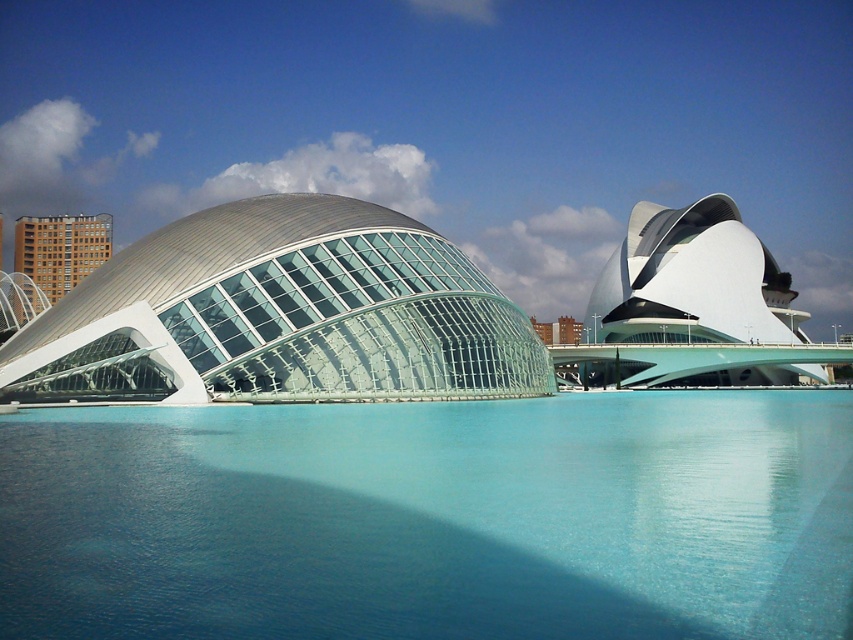
Who is shorter, transparent blue water at center or transparent glass dome at center?

With less height is transparent blue water at center.

Between transparent blue water at center and transparent glass dome at center, which one is positioned higher?

transparent glass dome at center is above.

The width and height of the screenshot is (853, 640). What are the coordinates of `transparent blue water at center` in the screenshot? It's located at (432, 518).

At what (x,y) coordinates should I click in order to perform the action: click on transparent blue water at center. Please return your answer as a coordinate pair (x, y). Looking at the image, I should click on (432, 518).

Between transparent glass dome at center and brown brick building at left, which one is positioned higher?

brown brick building at left

Is point (329, 253) more distant than point (36, 236)?

No, (329, 253) is in front of (36, 236).

Locate an element on the screen. This screenshot has height=640, width=853. transparent glass dome at center is located at coordinates (280, 314).

Between point (662, 433) and point (103, 224), which one is positioned behind?

Point (103, 224)

Identify the location of transparent blue water at center. (432, 518).

Where is `transparent blue water at center`? The width and height of the screenshot is (853, 640). transparent blue water at center is located at coordinates (432, 518).

Image resolution: width=853 pixels, height=640 pixels. Identify the location of transparent blue water at center. (432, 518).